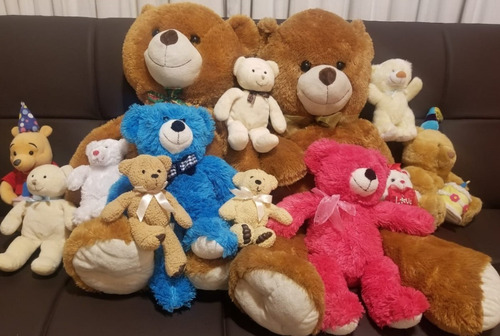
Find the location of a particular element. The image size is (500, 336). couch sections is located at coordinates (466, 98), (422, 40), (111, 67), (47, 54), (278, 18), (100, 312), (29, 286), (478, 139), (486, 230), (63, 134).